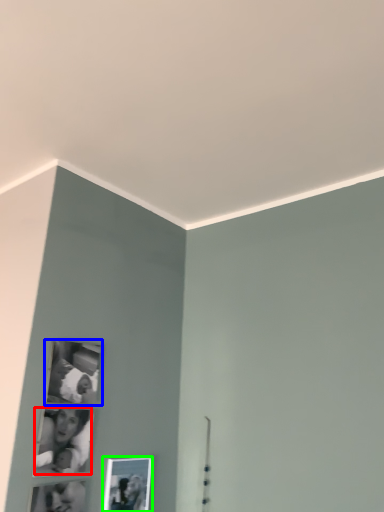
Question: Which is farther away from couple (highlighted by a red box)? picture frame (highlighted by a blue box) or picture frame (highlighted by a green box)?

Choices:
 (A) picture frame
 (B) picture frame

Answer: (B)